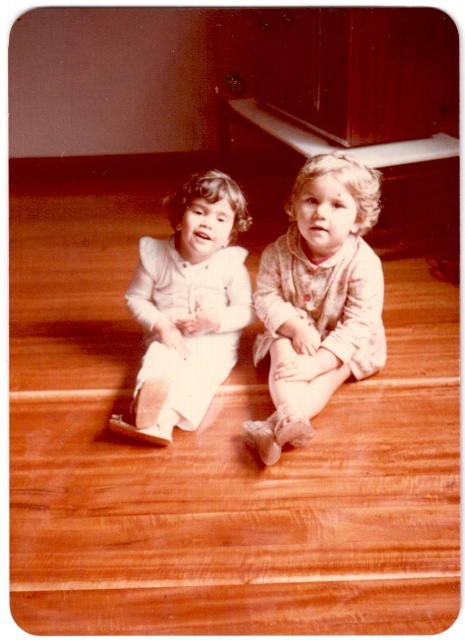
Question: Does fluffy pink pajamas at center appear under white satin dress at center?

Choices:
 (A) yes
 (B) no

Answer: (B)

Question: Which object is closer to the camera taking this photo?

Choices:
 (A) fluffy pink pajamas at center
 (B) white satin dress at center

Answer: (A)

Question: Can you confirm if fluffy pink pajamas at center is thinner than white satin dress at center?

Choices:
 (A) yes
 (B) no

Answer: (B)

Question: Which of the following is the farthest from the observer?

Choices:
 (A) (287, 428)
 (B) (178, 212)

Answer: (B)

Question: Observing the image, what is the correct spatial positioning of fluffy pink pajamas at center in reference to white satin dress at center?

Choices:
 (A) above
 (B) below

Answer: (A)